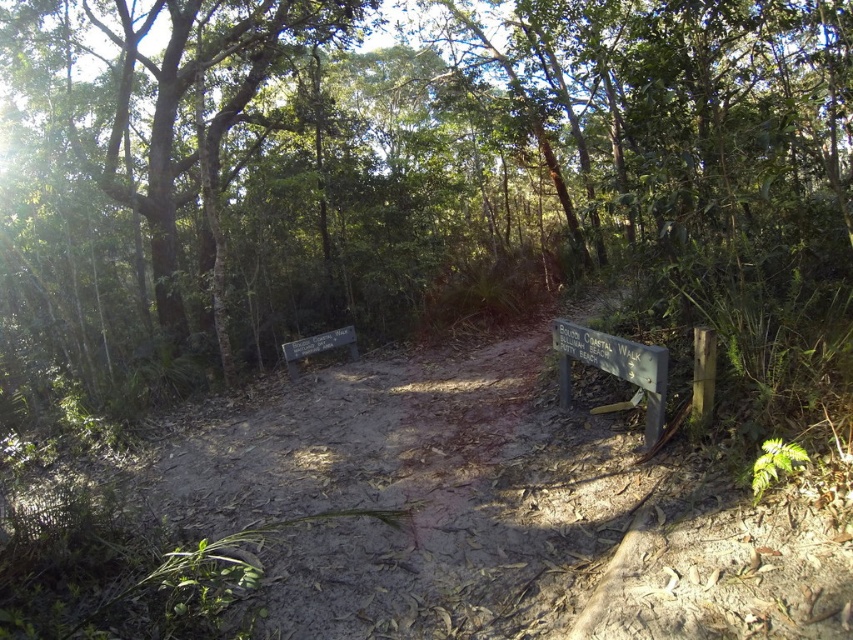
You are a hiker planning to take a photo of the wooden sign at center and the green leafy tree at left. To ensure both are fully visible in the frame, which object should you position closer to the camera?

Since the green leafy tree at left is wider than the wooden sign at center, you should position the green leafy tree at left closer to the camera to ensure both fit in the frame.

You are standing at the intersection of the forest trail and need to decide which path to take. There is a green leafy tree at center. Which direction does the tree suggest you should go based on its position relative to the trail split?

The green leafy tree at center is located at point (399, 176), which is to the right of the trail split. This suggests the tree is positioned towards the right path, so you should consider taking the right path.

You are a hiker trying to decide which path to take. You see a green leafy tree at center and a brown dirt track at center. Which object is wider from your perspective?

The green leafy tree at center might be wider than brown dirt track at center, so the green leafy tree at center is wider.